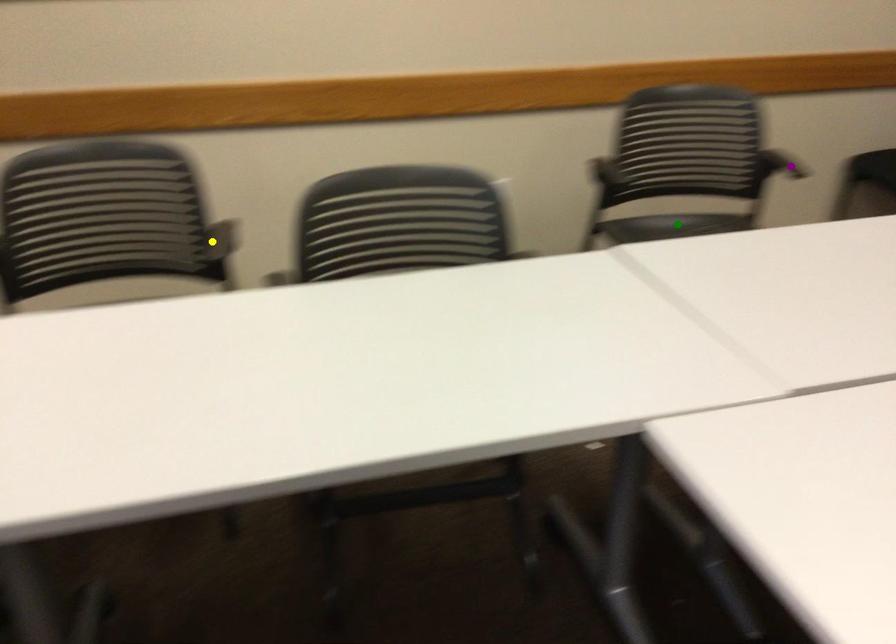
Order these from nearest to farthest:
yellow point
purple point
green point

purple point
green point
yellow point